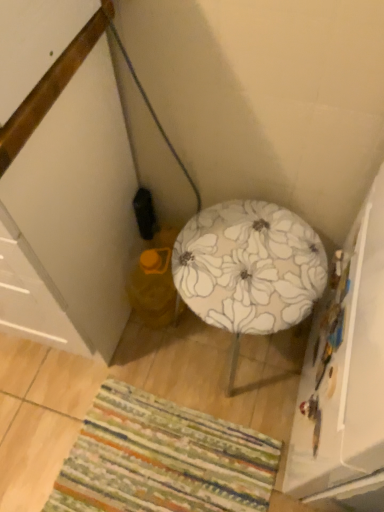
Question: From a real-world perspective, relative to yellow fabric bean bag chair at lower left, is white glossy cabinet at lower left vertically above or below?

Choices:
 (A) above
 (B) below

Answer: (A)

Question: Is white glossy cabinet at lower left inside or outside of yellow fabric bean bag chair at lower left?

Choices:
 (A) inside
 (B) outside

Answer: (B)

Question: Which object is the closest to the multicolored woven mat at lower center?

Choices:
 (A) floral fabric stool at center
 (B) yellow fabric bean bag chair at lower left
 (C) white glossy cabinet at lower left

Answer: (B)

Question: Estimate the real-world distances between objects in this image. Which object is closer to the floral fabric stool at center?

Choices:
 (A) multicolored woven mat at lower center
 (B) yellow fabric bean bag chair at lower left
 (C) white glossy cabinet at lower left

Answer: (B)